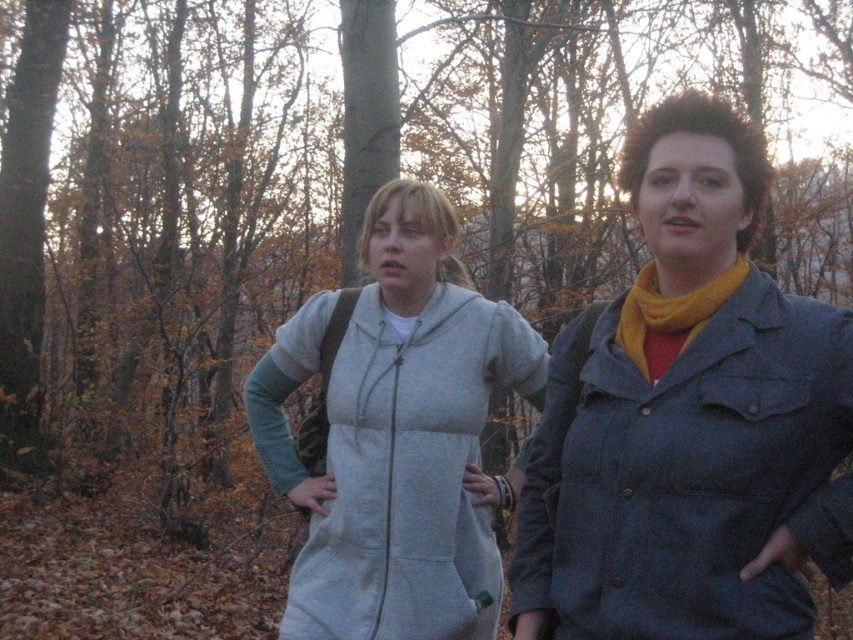
You are standing in the forest scene and want to determine which of the two points, point [410,308] or point [722,288], is closer to you. Based on the image, which point is nearer?

Point [410,308] is closer to you because it is further to the viewer than point [722,288].

You are a photographer trying to capture the autumn scene with the two people in the image. You want to ensure that both the denim jacket at right and the yellow fuzzy scarf at right are clearly visible in your photo. Based on their positions, which object should you focus on first to make sure both are in sharp focus?

The denim jacket at right is located below the yellow fuzzy scarf at right. To ensure both are in focus, you should focus on the yellow fuzzy scarf at right since it is higher up, allowing the depth of field to cover the denim jacket below it.